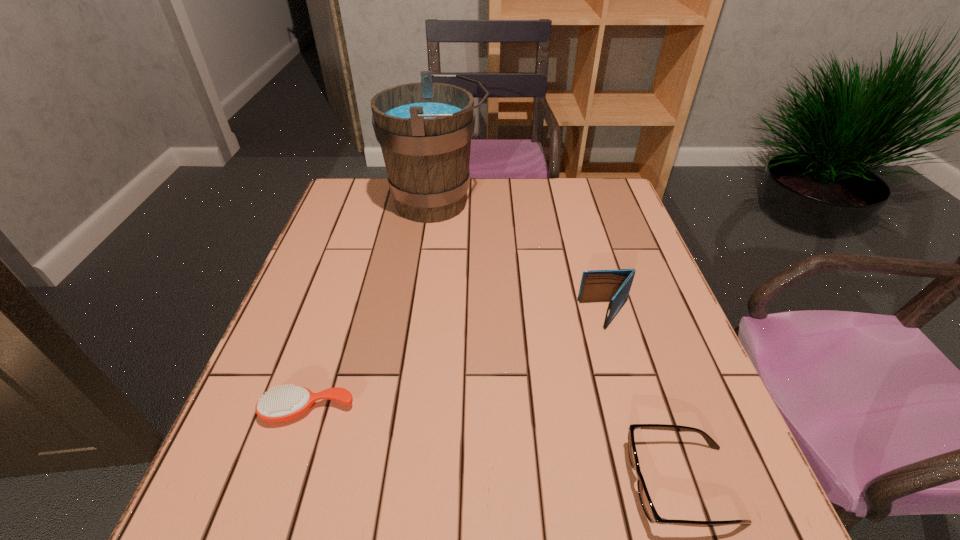
Locate which object is the closest to the third farthest object. Please provide its 2D coordinates. Your answer should be formatted as a tuple, i.e. [(x, y)], where the tuple contains the x and y coordinates of a point satisfying the conditions above.

[(646, 502)]

The height and width of the screenshot is (540, 960). In order to click on object that can be found as the second closest to the third farthest object in this screenshot , I will do `click(614, 286)`.

Locate an element on the screen. The height and width of the screenshot is (540, 960). free space that satisfies the following two spatial constraints: 1. on the exterior surface of the wallet; 2. on the front side of the hairbrush is located at coordinates (634, 410).